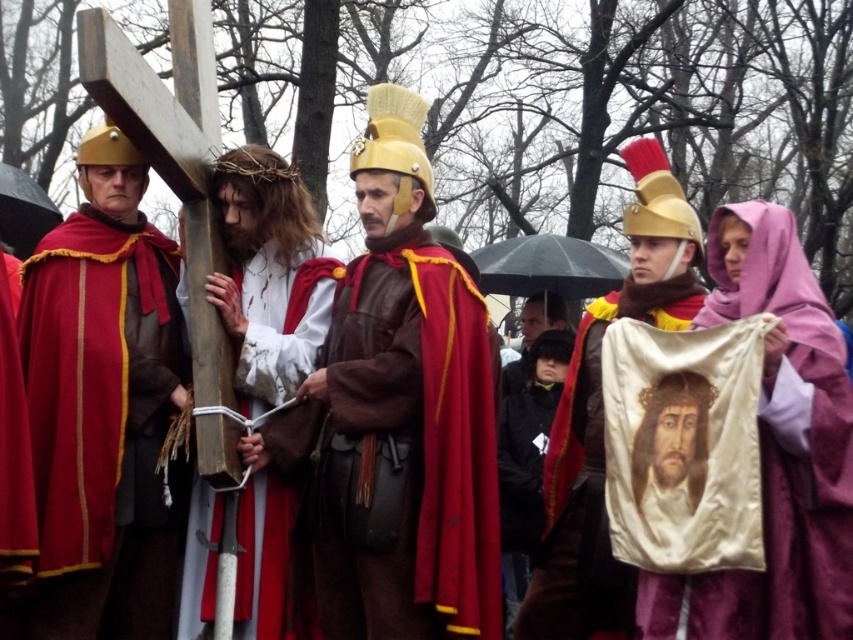
Who is higher up, wooden cross at center or smooth white cloth at center?

wooden cross at center is above.

Is wooden cross at center to the right of smooth white cloth at center from the viewer's perspective?

In fact, wooden cross at center is to the left of smooth white cloth at center.

Is point (250, 252) positioned behind point (692, 465)?

Yes, it is behind point (692, 465).

I want to click on wooden cross at center, so click(270, 275).

How much distance is there between matte gold helmet at left and wooden cross at center?

matte gold helmet at left is 3.55 meters away from wooden cross at center.

How far apart are matte gold helmet at left and wooden cross at center?

3.55 meters

Does point (88, 557) come behind point (311, 250)?

That is False.

Where is `matte gold helmet at left`? matte gold helmet at left is located at coordinates (102, 403).

Who is shorter, leather helmet at center or purple velvet veil at upper right?

Standing shorter between the two is purple velvet veil at upper right.

Can you confirm if leather helmet at center is bigger than purple velvet veil at upper right?

Correct, leather helmet at center is larger in size than purple velvet veil at upper right.

Locate an element on the screen. This screenshot has height=640, width=853. leather helmet at center is located at coordinates (398, 413).

Image resolution: width=853 pixels, height=640 pixels. Identify the location of leather helmet at center. click(398, 413).